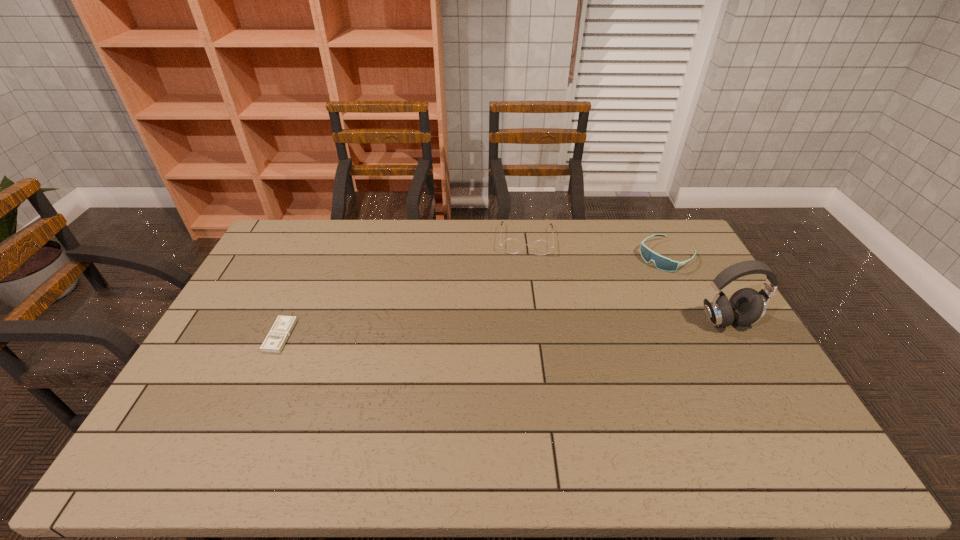
This screenshot has height=540, width=960. What are the coordinates of `unoccupied position between the headset and the goggles` in the screenshot? It's located at (697, 288).

Where is `vacant space in between the shortest object and the spectacles`? vacant space in between the shortest object and the spectacles is located at coordinates (403, 288).

The image size is (960, 540). Identify the location of free space between the tallest object and the goggles. (697, 288).

This screenshot has height=540, width=960. What are the coordinates of `free space between the money and the spectacles` in the screenshot? It's located at (403, 288).

Locate an element on the screen. Image resolution: width=960 pixels, height=540 pixels. vacant region between the money and the goggles is located at coordinates (473, 296).

Where is `object that ranks as the second closest to the leftmost object`? This screenshot has height=540, width=960. object that ranks as the second closest to the leftmost object is located at coordinates (662, 263).

This screenshot has height=540, width=960. I want to click on the third closest object to the tallest object, so click(x=274, y=342).

Find the location of a particular element. The width and height of the screenshot is (960, 540). vacant point that satisfies the following two spatial constraints: 1. on the back side of the leftmost object; 2. on the left side of the goggles is located at coordinates (316, 256).

The width and height of the screenshot is (960, 540). In order to click on free space that satisfies the following two spatial constraints: 1. on the back side of the money; 2. on the right side of the second object from left to right in this screenshot , I will do `click(324, 240)`.

You are a GUI agent. You are given a task and a screenshot of the screen. Output one action in this format:
    pyautogui.click(x=<x>, y=<y>)
    Task: Click on the free space that satisfies the following two spatial constraints: 1. on the back side of the goggles; 2. on the right side of the leftmost object
    This screenshot has height=540, width=960.
    Given the screenshot: What is the action you would take?
    pyautogui.click(x=316, y=256)